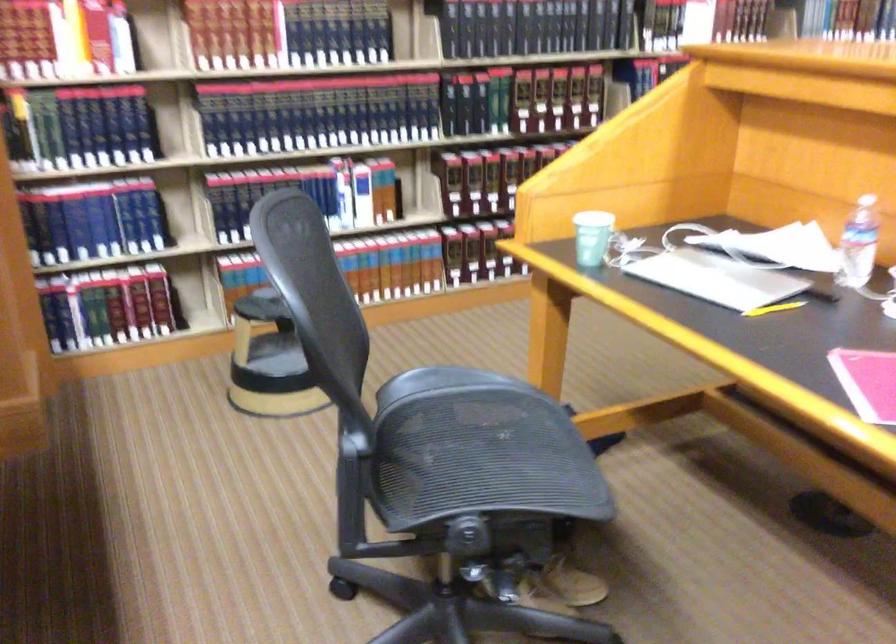
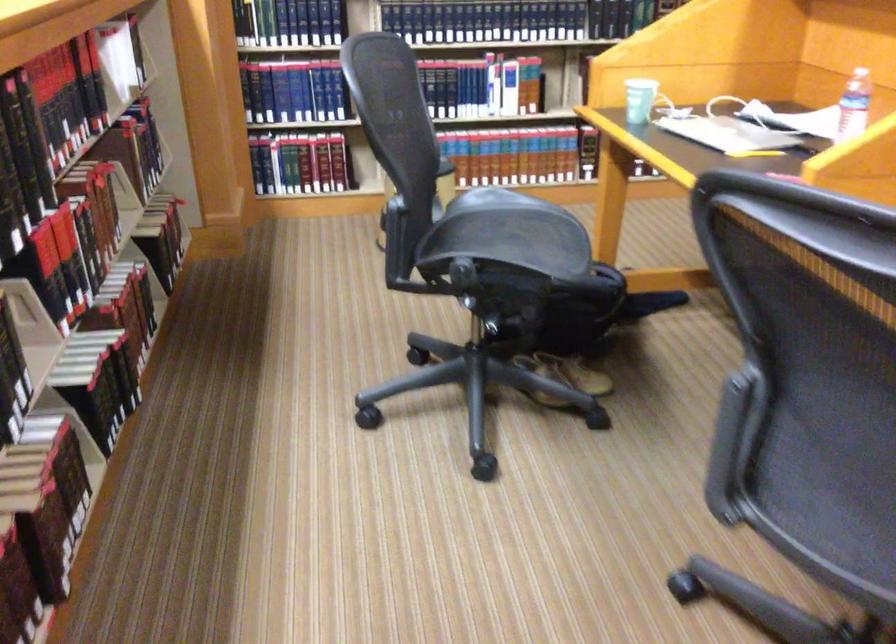
Locate, in the second image, the point that corresponds to (x=593, y=240) in the first image.

(640, 100)